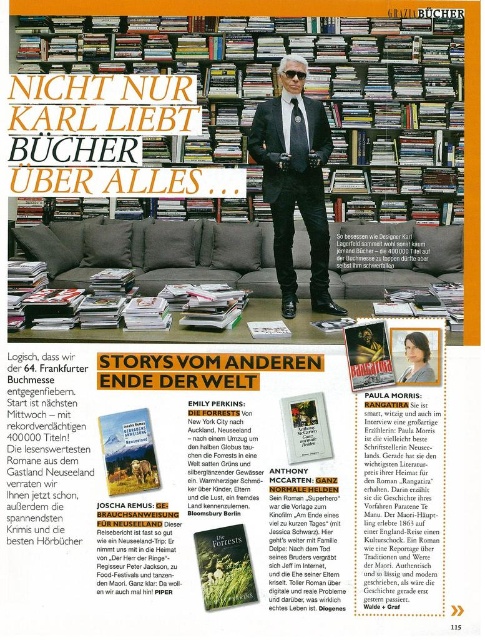
You are a graphic designer working on a layout for a new advertisement. You need to ensure that the matte paper magazine at center and the black plastic goggles at upper center are arranged in a way that maintains visual hierarchy. Which object should be placed higher to draw attention first?

The black plastic goggles at upper center should be placed higher to draw attention first since the matte paper magazine at center is positioned under it, indicating that the goggles are already above in the current layout.

You are looking at the image from the front. There is a point labeled as point [306,428] in the image. Can you tell me what object is located at that point?

The point [306,428] corresponds to the matte paper magazine at center.

You are a photographer who needs to place a small decorative item exactly at the point marked by the coordinates point (307, 90). According to the scene, where should you place the item?

The point (307, 90) corresponds to the wooden bookshelf at upper center, so you should place the item there.